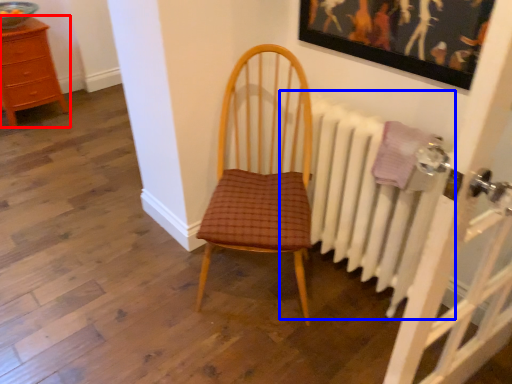
Question: Which object is further to the camera taking this photo, chest of drawers (highlighted by a red box) or radiator (highlighted by a blue box)?

Choices:
 (A) chest of drawers
 (B) radiator

Answer: (A)